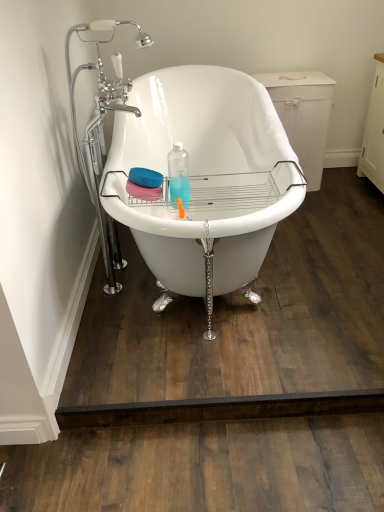
Where is `vacant point to the right of white glossy bathtub at center`? The height and width of the screenshot is (512, 384). vacant point to the right of white glossy bathtub at center is located at coordinates (327, 241).